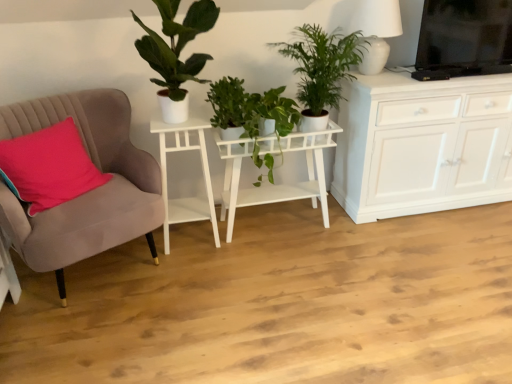
How much space does green leafy plant at upper center, marked as the first houseplant in a right-to-left arrangement, occupy vertically?

green leafy plant at upper center, marked as the first houseplant in a right-to-left arrangement, is 25.84 inches in height.

This screenshot has width=512, height=384. What do you see at coordinates (272, 184) in the screenshot?
I see `white matte plant stand at center, the 2th table from the left` at bounding box center [272, 184].

Measure the distance between white matte side table at left, placed as the second table when sorted from right to left, and camera.

The distance of white matte side table at left, placed as the second table when sorted from right to left, from camera is 7.46 feet.

Describe the element at coordinates (88, 192) in the screenshot. The image size is (512, 384). I see `suede armchair at left` at that location.

Locate an element on the screen. Image resolution: width=512 pixels, height=384 pixels. green leafy plant at upper center, placed as the 3th houseplant when sorted from left to right is located at coordinates (322, 64).

Does point (380, 45) come in front of point (193, 201)?

That is True.

Is white ceramic lamp at upper right turned away from white matte side table at left, placed as the second table when sorted from right to left?

white ceramic lamp at upper right does not have its back to white matte side table at left, placed as the second table when sorted from right to left.

From a real-world perspective, is white ceramic lamp at upper right physically below white matte side table at left, placed as the second table when sorted from right to left?

Actually, white ceramic lamp at upper right is physically above white matte side table at left, placed as the second table when sorted from right to left, in the real world.

This screenshot has width=512, height=384. Identify the location of lamp above the white matte side table at left, placed as the second table when sorted from right to left (from the image's perspective). (376, 31).

Between green matte plant at upper left, which is counted as the third houseplant, starting from the right, and white ceramic lamp at upper right, which one is positioned in front?

green matte plant at upper left, which is counted as the third houseplant, starting from the right.

From the white ceramic lamp at upper right, count 3rd houseplants forward and point to it. Please provide its 2D coordinates.

[(176, 52)]

Could you tell me if green matte plant at upper left, which is the first houseplant in left-to-right order, is turned towards white ceramic lamp at upper right?

No, green matte plant at upper left, which is the first houseplant in left-to-right order, is not turned towards white ceramic lamp at upper right.

Looking at the image, does green matte plant at upper left, which is the first houseplant in left-to-right order, seem bigger or smaller compared to white ceramic lamp at upper right?

Considering their sizes, green matte plant at upper left, which is the first houseplant in left-to-right order, takes up more space than white ceramic lamp at upper right.

From the image's perspective, which is above, white matte side table at left, placed as the second table when sorted from right to left, or green leafy plant at upper center, placed as the 3th houseplant when sorted from left to right?

green leafy plant at upper center, placed as the 3th houseplant when sorted from left to right.

In the image, is white matte side table at left, placed as the second table when sorted from right to left, positioned in front of or behind green leafy plant at upper center, marked as the first houseplant in a right-to-left arrangement?

Visually, white matte side table at left, placed as the second table when sorted from right to left, is located behind green leafy plant at upper center, marked as the first houseplant in a right-to-left arrangement.

Is white matte side table at left, placed as the second table when sorted from right to left, not within green leafy plant at upper center, placed as the 3th houseplant when sorted from left to right?

Indeed, white matte side table at left, placed as the second table when sorted from right to left, is completely outside green leafy plant at upper center, placed as the 3th houseplant when sorted from left to right.

Is white matte side table at left, placed as the second table when sorted from right to left, facing away from green leafy plant at upper center, placed as the 3th houseplant when sorted from left to right?

No, green leafy plant at upper center, placed as the 3th houseplant when sorted from left to right, is not at the back of white matte side table at left, placed as the second table when sorted from right to left.

Between white ceramic lamp at upper right and green leafy plant at upper center, marked as the first houseplant in a right-to-left arrangement, which one has less height?

With less height is white ceramic lamp at upper right.

Looking at their sizes, would you say white ceramic lamp at upper right is wider or thinner than green leafy plant at upper center, marked as the first houseplant in a right-to-left arrangement?

Clearly, white ceramic lamp at upper right has less width compared to green leafy plant at upper center, marked as the first houseplant in a right-to-left arrangement.

Based on the photo, can you tell me how much white ceramic lamp at upper right and green leafy plant at upper center, marked as the first houseplant in a right-to-left arrangement, differ in facing direction?

The angular difference between white ceramic lamp at upper right and green leafy plant at upper center, marked as the first houseplant in a right-to-left arrangement, is 1.4 degrees.

Is green leafy plant at upper center, placed as the 3th houseplant when sorted from left to right, at the back of white ceramic lamp at upper right?

white ceramic lamp at upper right does not have its back to green leafy plant at upper center, placed as the 3th houseplant when sorted from left to right.

Between white ceramic lamp at upper right and white matte plant stand at center, the 2th table from the left, which one is positioned in front?

white matte plant stand at center, the 2th table from the left, is closer to the camera.

Who is shorter, white ceramic lamp at upper right or white matte plant stand at center, the 2th table from the left?

white ceramic lamp at upper right is shorter.

Consider the image. Is white ceramic lamp at upper right facing towards white matte plant stand at center, the first table positioned from the right?

No.

In the image, there is a white matte plant stand at center, the 2th table from the left. At what (x,y) coordinates should I click in order to perform the action: click on lamp above it (from the image's perspective). Please return your answer as a coordinate pair (x, y). This screenshot has height=384, width=512. Looking at the image, I should click on (376, 31).

Based on their positions, is green leafy plant at upper center, placed as the 3th houseplant when sorted from left to right, located to the left or right of suede armchair at left?

Clearly, green leafy plant at upper center, placed as the 3th houseplant when sorted from left to right, is on the right of suede armchair at left in the image.

Considering the relative positions of green leafy plant at upper center, placed as the 3th houseplant when sorted from left to right, and suede armchair at left in the image provided, is green leafy plant at upper center, placed as the 3th houseplant when sorted from left to right, behind suede armchair at left?

Yes, green leafy plant at upper center, placed as the 3th houseplant when sorted from left to right, is further from the camera.

Consider the image. Which of these two, green leafy plant at upper center, placed as the 3th houseplant when sorted from left to right, or suede armchair at left, is wider?

With larger width is suede armchair at left.

Which point is more forward, (348,58) or (137,222)?

The point (348,58) is more forward.

How distant is green glossy plant at center, which appears as the second houseplant when viewed from the right, from white matte plant stand at center, the 2th table from the left?

green glossy plant at center, which appears as the second houseplant when viewed from the right, is 12.61 inches away from white matte plant stand at center, the 2th table from the left.

Which object is further away from the camera taking this photo, green glossy plant at center, which appears as the second houseplant when viewed from the right, or white matte plant stand at center, the first table positioned from the right?

white matte plant stand at center, the first table positioned from the right, is more distant.

Looking at this image, can you confirm if green glossy plant at center, which appears as the second houseplant when viewed from the right, is positioned to the right of white matte plant stand at center, the first table positioned from the right?

Incorrect, green glossy plant at center, which appears as the second houseplant when viewed from the right, is not on the right side of white matte plant stand at center, the first table positioned from the right.

Does green glossy plant at center, the second houseplant viewed from the left, turn towards white matte plant stand at center, the first table positioned from the right?

No, green glossy plant at center, the second houseplant viewed from the left, is not facing towards white matte plant stand at center, the first table positioned from the right.

Locate an element on the screen. table that is the 2nd one when counting leftward from the white ceramic lamp at upper right is located at coordinates (202, 171).

In order to click on lamp behind the green matte plant at upper left, which is the first houseplant in left-to-right order in this screenshot , I will do `click(376, 31)`.

Looking at this image, based on their spatial positions, is white ceramic lamp at upper right or green leafy plant at upper center, placed as the 3th houseplant when sorted from left to right, closer to white matte plant stand at center, the 2th table from the left?

green leafy plant at upper center, placed as the 3th houseplant when sorted from left to right, is closer to white matte plant stand at center, the 2th table from the left.

Based on their spatial positions, is white matte side table at left, placed as the second table when sorted from right to left, or green leafy plant at upper center, marked as the first houseplant in a right-to-left arrangement, further from green matte plant at upper left, which is counted as the third houseplant, starting from the right?

green leafy plant at upper center, marked as the first houseplant in a right-to-left arrangement, is further to green matte plant at upper left, which is counted as the third houseplant, starting from the right.

Based on their spatial positions, is green matte plant at upper left, which is counted as the third houseplant, starting from the right, or pink fabric pillow at left further from white matte plant stand at center, the 2th table from the left?

Among the two, pink fabric pillow at left is located further to white matte plant stand at center, the 2th table from the left.

Looking at the image, which one is located closer to green glossy plant at center, which appears as the second houseplant when viewed from the right, green leafy plant at upper center, placed as the 3th houseplant when sorted from left to right, or white ceramic lamp at upper right?

The object closer to green glossy plant at center, which appears as the second houseplant when viewed from the right, is green leafy plant at upper center, placed as the 3th houseplant when sorted from left to right.

Considering their positions, is suede armchair at left positioned further to white matte side table at left, placed as the second table when sorted from right to left, than green glossy plant at center, which appears as the second houseplant when viewed from the right?

suede armchair at left.

Estimate the real-world distances between objects in this image. Which object is further from pink fabric pillow at left, green glossy plant at center, which appears as the second houseplant when viewed from the right, or green leafy plant at upper center, placed as the 3th houseplant when sorted from left to right?

green leafy plant at upper center, placed as the 3th houseplant when sorted from left to right, lies further to pink fabric pillow at left than the other object.

Considering their positions, is white matte plant stand at center, the 2th table from the left, positioned closer to suede armchair at left than white matte side table at left, which is counted as the 1th table, starting from the left?

white matte side table at left, which is counted as the 1th table, starting from the left.

Estimate the real-world distances between objects in this image. Which object is closer to green matte plant at upper left, which is counted as the third houseplant, starting from the right, green glossy plant at center, the second houseplant viewed from the left, or white matte side table at left, which is counted as the 1th table, starting from the left?

green glossy plant at center, the second houseplant viewed from the left, lies closer to green matte plant at upper left, which is counted as the third houseplant, starting from the right, than the other object.

Identify the location of houseplant between green matte plant at upper left, which is the first houseplant in left-to-right order, and green leafy plant at upper center, marked as the first houseplant in a right-to-left arrangement. (231, 106).

Find the location of `chair located between pink fabric pillow at left and green glossy plant at center, which appears as the second houseplant when viewed from the right, in the left-right direction`. chair located between pink fabric pillow at left and green glossy plant at center, which appears as the second houseplant when viewed from the right, in the left-right direction is located at coordinates (88, 192).

The image size is (512, 384). Find the location of `table situated between white matte side table at left, which is counted as the 1th table, starting from the left, and white ceramic lamp at upper right from left to right`. table situated between white matte side table at left, which is counted as the 1th table, starting from the left, and white ceramic lamp at upper right from left to right is located at coordinates (272, 184).

Image resolution: width=512 pixels, height=384 pixels. I want to click on table between white matte side table at left, which is counted as the 1th table, starting from the left, and green leafy plant at upper center, marked as the first houseplant in a right-to-left arrangement, from left to right, so click(272, 184).